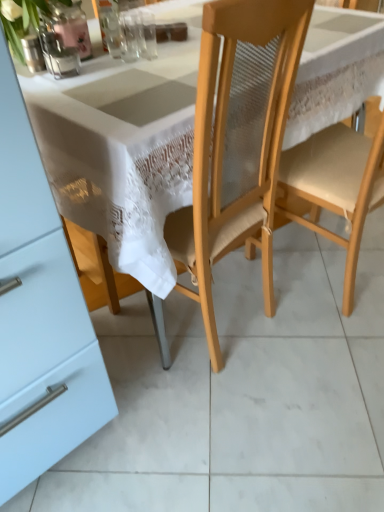
The width and height of the screenshot is (384, 512). I want to click on vacant area that lies to the right of matte glass vase at upper left, the third tableware viewed from the right, so click(x=105, y=72).